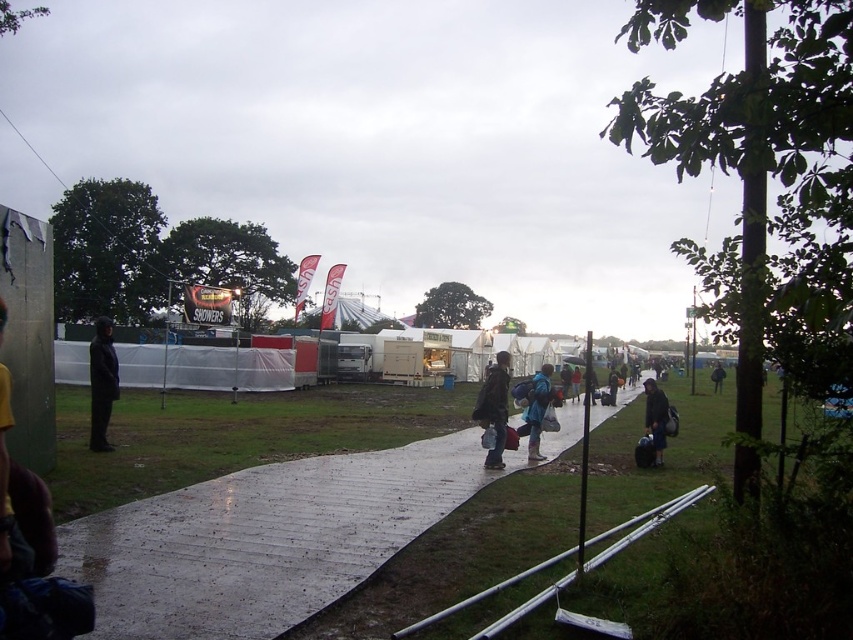
Does dark blue jacket at center appear under black fabric bag at center-right?

Actually, dark blue jacket at center is above black fabric bag at center-right.

Does point (610, 388) come farther from viewer compared to point (717, 360)?

No, (610, 388) is closer to viewer.

Is point (608, 403) positioned behind point (715, 365)?

No, it is not.

I want to click on dark blue jacket at center, so click(x=612, y=385).

Consider the image. Is wet plastic walkway at center wider than blue fabric jacket at center?

Yes, wet plastic walkway at center is wider than blue fabric jacket at center.

Is wet plastic walkway at center closer to camera compared to blue fabric jacket at center?

Yes, wet plastic walkway at center is in front of blue fabric jacket at center.

This screenshot has height=640, width=853. Describe the element at coordinates (265, 540) in the screenshot. I see `wet plastic walkway at center` at that location.

At what (x,y) coordinates should I click in order to perform the action: click on wet plastic walkway at center. Please return your answer as a coordinate pair (x, y). The image size is (853, 640). Looking at the image, I should click on (265, 540).

From the picture: Does blue fabric jacket at center come behind black fabric bag at center-right?

No.

I want to click on blue fabric jacket at center, so click(x=537, y=410).

Describe the element at coordinates (537, 410) in the screenshot. I see `blue fabric jacket at center` at that location.

You are a GUI agent. You are given a task and a screenshot of the screen. Output one action in this format:
    pyautogui.click(x=<x>, y=<y>)
    Task: Click on the blue fabric jacket at center
    
    Given the screenshot: What is the action you would take?
    pyautogui.click(x=537, y=410)